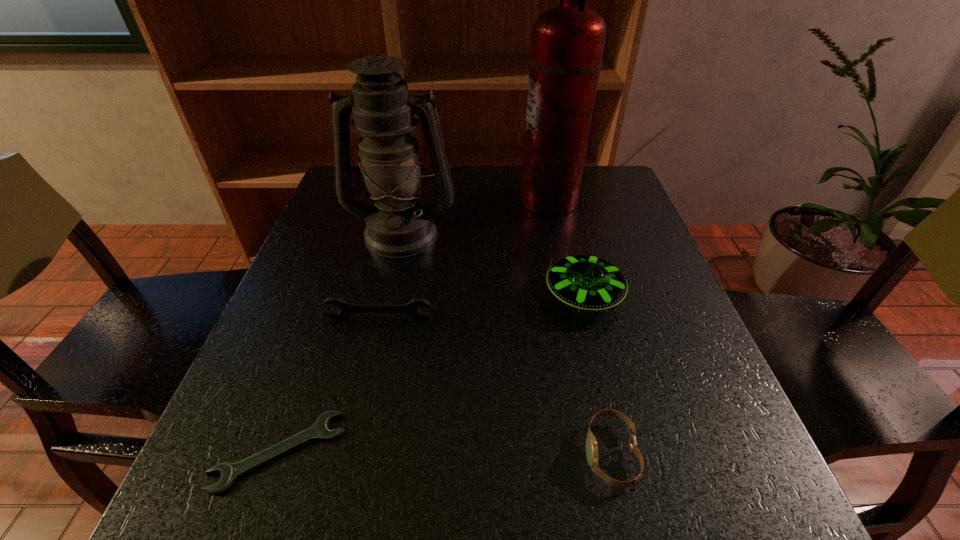
Locate an element on the screen. vacant space located 0.190m on the front of the oil lamp is located at coordinates (382, 321).

Where is `free space located 0.130m on the front of the saucer`? free space located 0.130m on the front of the saucer is located at coordinates (605, 382).

Where is `free region located 0.230m on the open ends of the farther wrench`? This screenshot has height=540, width=960. free region located 0.230m on the open ends of the farther wrench is located at coordinates (353, 428).

Where is `vacant area situated 0.080m on the face of the watch`? This screenshot has height=540, width=960. vacant area situated 0.080m on the face of the watch is located at coordinates (532, 454).

Image resolution: width=960 pixels, height=540 pixels. I want to click on vacant space located 0.250m on the face of the watch, so click(x=418, y=454).

This screenshot has width=960, height=540. I want to click on blank space located 0.180m on the face of the watch, so [x=465, y=454].

You are a GUI agent. You are given a task and a screenshot of the screen. Output one action in this format:
    pyautogui.click(x=<x>, y=<y>)
    Task: Click on the vacant position located 0.250m on the back of the shortest object
    The width and height of the screenshot is (960, 540).
    Given the screenshot: What is the action you would take?
    pyautogui.click(x=331, y=302)

At what (x,y) coordinates should I click in order to perform the action: click on fire extinguisher that is at the far edge. Please return your answer as a coordinate pair (x, y). This screenshot has width=960, height=540. Looking at the image, I should click on (567, 44).

This screenshot has width=960, height=540. Find the location of `oil lamp at the far edge`. oil lamp at the far edge is located at coordinates (399, 225).

The image size is (960, 540). Find the location of `watch present at the near edge`. watch present at the near edge is located at coordinates (591, 445).